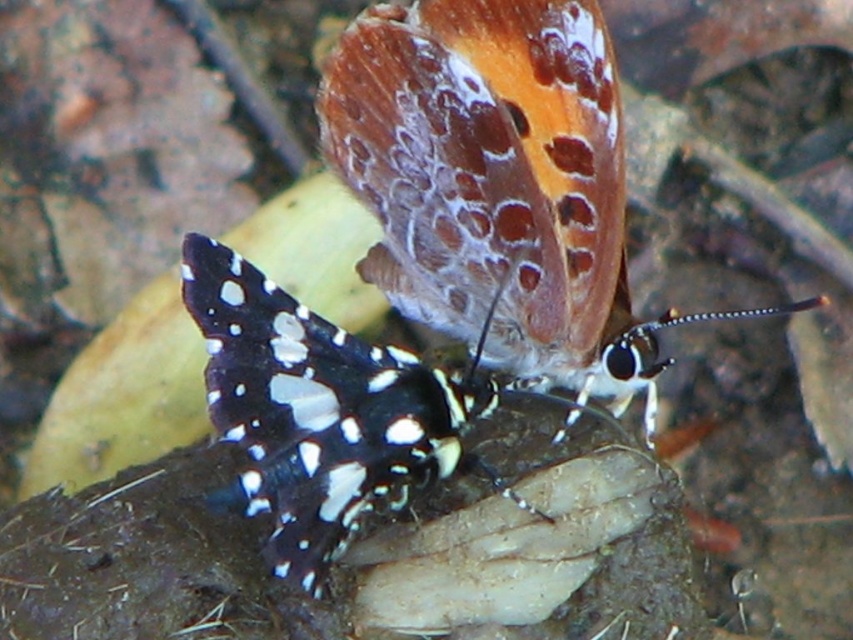
Question: Among these points, which one is nearest to the camera?

Choices:
 (A) (393, 292)
 (B) (326, 428)

Answer: (B)

Question: Among these objects, which one is nearest to the camera?

Choices:
 (A) translucent orange butterfly at upper center
 (B) black and white spotted butterfly at center

Answer: (B)

Question: Can you confirm if translucent orange butterfly at upper center is positioned to the left of black and white spotted butterfly at center?

Choices:
 (A) no
 (B) yes

Answer: (A)

Question: Can you confirm if translucent orange butterfly at upper center is smaller than black and white spotted butterfly at center?

Choices:
 (A) yes
 (B) no

Answer: (A)

Question: Is translucent orange butterfly at upper center to the left of black and white spotted butterfly at center from the viewer's perspective?

Choices:
 (A) no
 (B) yes

Answer: (A)